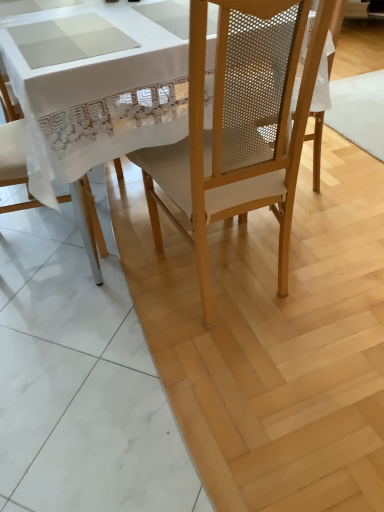
What are the coordinates of `vacant space to the right of white fabric chair at left, acting as the 2th chair starting from the right` in the screenshot? It's located at (131, 234).